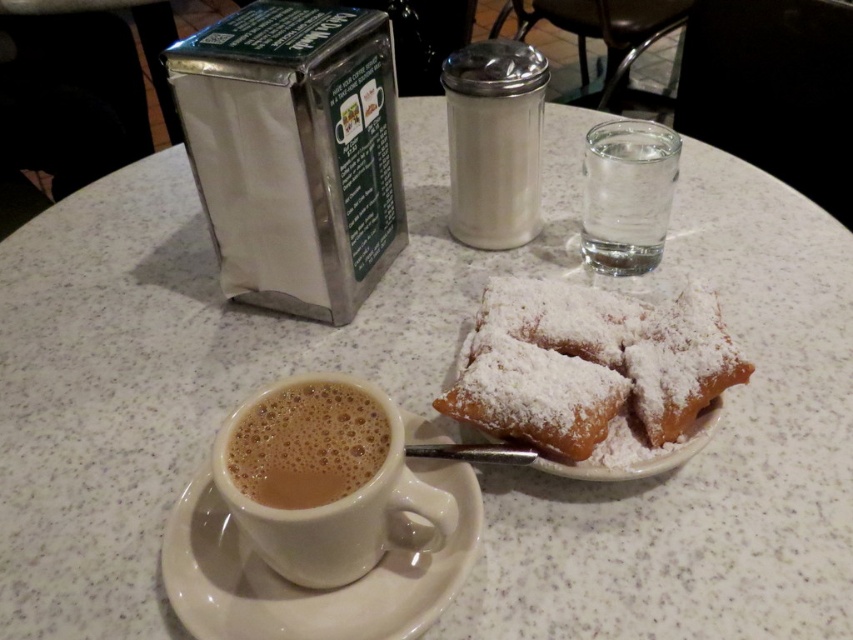
Question: Does brown frothy coffee at lower left appear on the right side of clear glass water at upper right?

Choices:
 (A) yes
 (B) no

Answer: (B)

Question: Based on their relative distances, which object is farther from the satin silver sugar shaker at upper center?

Choices:
 (A) brown frothy coffee at lower left
 (B) clear glass water at upper right
 (C) powdery golden pastry at center
 (D) white glossy saucer at lower left

Answer: (A)

Question: Is the position of powdery golden pastry at center less distant than that of satin silver sugar shaker at upper center?

Choices:
 (A) yes
 (B) no

Answer: (A)

Question: Which object is positioned farthest from the satin silver sugar shaker at upper center?

Choices:
 (A) powdery golden pastry at center
 (B) white glossy saucer at lower left
 (C) clear glass water at upper right

Answer: (B)

Question: Can you confirm if white glossy saucer at lower left is positioned to the right of satin silver sugar shaker at upper center?

Choices:
 (A) yes
 (B) no

Answer: (B)

Question: Estimate the real-world distances between objects in this image. Which object is closer to the white glossy saucer at lower left?

Choices:
 (A) satin silver sugar shaker at upper center
 (B) powdery golden pastry at center
 (C) clear glass water at upper right
 (D) brown frothy coffee at lower left

Answer: (D)